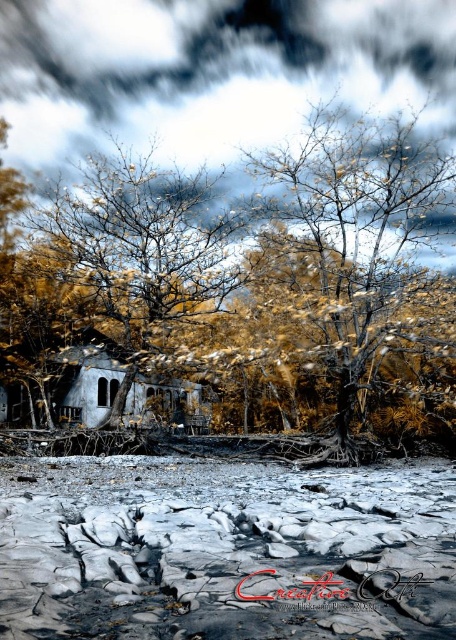
Does cracked mud puddle at lower center appear under yellowish-brown textured tree at center?

Correct, cracked mud puddle at lower center is located below yellowish-brown textured tree at center.

Does cracked mud puddle at lower center have a lesser height compared to yellowish-brown textured tree at center?

Yes, cracked mud puddle at lower center is shorter than yellowish-brown textured tree at center.

Is point (210, 532) farther from camera compared to point (191, 301)?

No, it is in front of (191, 301).

Locate an element on the screen. This screenshot has width=456, height=640. cracked mud puddle at lower center is located at coordinates (224, 550).

Consider the image. Is golden textured tree at center shorter than yellowish-brown textured tree at center?

No.

Which is more to the right, golden textured tree at center or yellowish-brown textured tree at center?

Positioned to the right is golden textured tree at center.

Does point (363, 310) come in front of point (122, 291)?

Yes, point (363, 310) is closer to viewer.

Identify the location of golden textured tree at center. This screenshot has width=456, height=640. (359, 227).

Which is below, cracked mud puddle at lower center or golden textured tree at center?

cracked mud puddle at lower center

Does cracked mud puddle at lower center have a greater height compared to golden textured tree at center?

In fact, cracked mud puddle at lower center may be shorter than golden textured tree at center.

Is point (31, 524) closer to camera compared to point (362, 134)?

Yes, it is.

The image size is (456, 640). I want to click on cracked mud puddle at lower center, so click(224, 550).